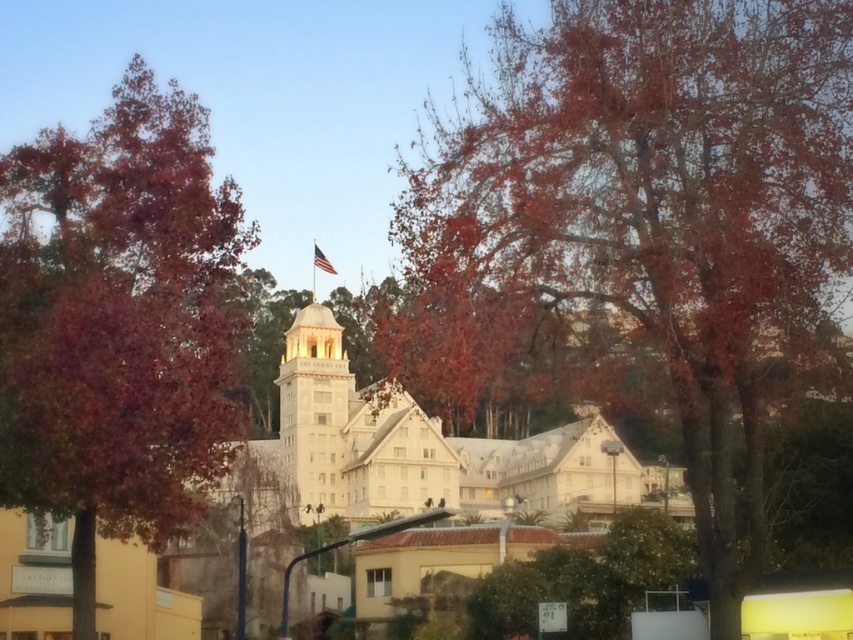
Consider the image. Between reddish-brown bark tree at center and white smooth tower at center, which one has less height?

white smooth tower at center is shorter.

Consider the image. Does reddish-brown bark tree at center appear over white smooth tower at center?

Yes.

Between point (737, 269) and point (345, 504), which one is positioned in front?

Point (737, 269)

The image size is (853, 640). Identify the location of reddish-brown bark tree at center. (641, 236).

Does reddish-brown bark tree at center come in front of reddish-brown textured leaves at left?

No, reddish-brown bark tree at center is behind reddish-brown textured leaves at left.

Is reddish-brown bark tree at center to the left of reddish-brown textured leaves at left from the viewer's perspective?

No, reddish-brown bark tree at center is not to the left of reddish-brown textured leaves at left.

Identify the location of reddish-brown bark tree at center. click(x=641, y=236).

This screenshot has height=640, width=853. I want to click on reddish-brown bark tree at center, so click(x=641, y=236).

Does reddish-brown textured leaves at left have a lesser height compared to white fabric flag at center?

Incorrect, reddish-brown textured leaves at left's height does not fall short of white fabric flag at center's.

Between reddish-brown textured leaves at left and white fabric flag at center, which one is positioned lower?

reddish-brown textured leaves at left is below.

Find the location of a particular element. This screenshot has height=640, width=853. reddish-brown textured leaves at left is located at coordinates (119, 323).